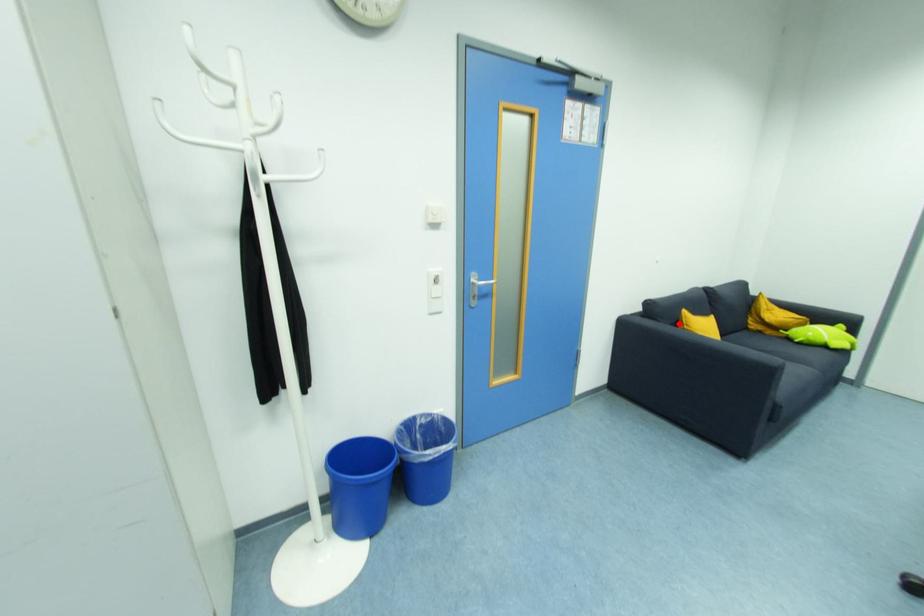
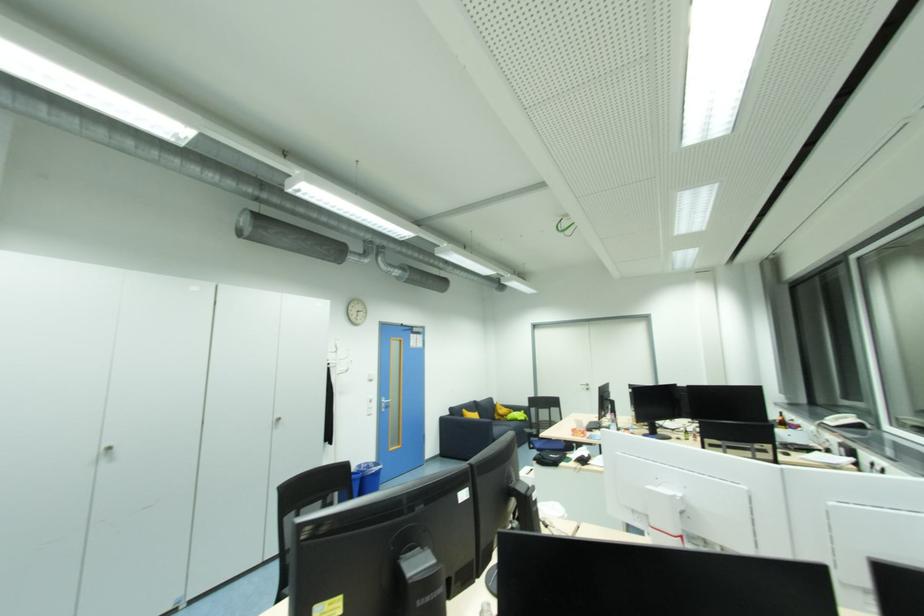
Locate, in the second image, the point that corresponds to the highlighted location in the first image.

(466, 416)